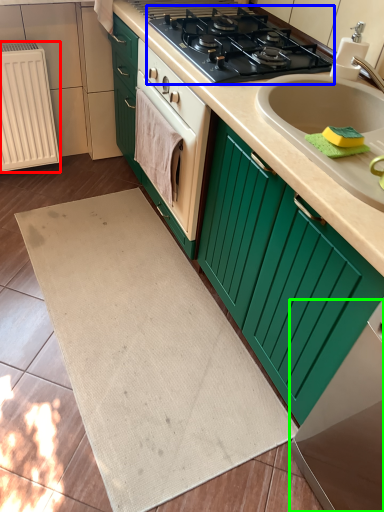
Question: Which object is the farthest from radiator (highlighted by a red box)? Choose among these: gas stove (highlighted by a blue box) or appliance (highlighted by a green box).

Choices:
 (A) gas stove
 (B) appliance

Answer: (B)